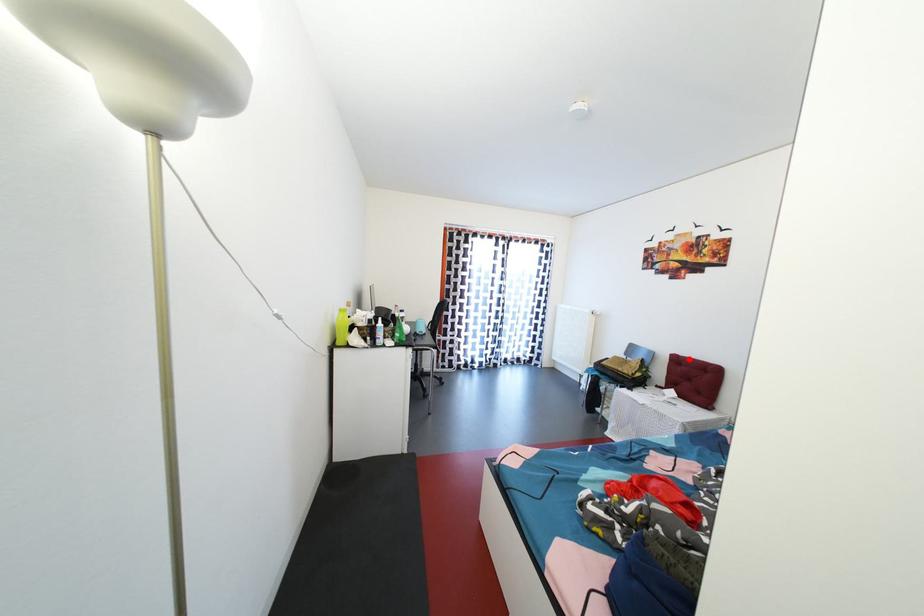
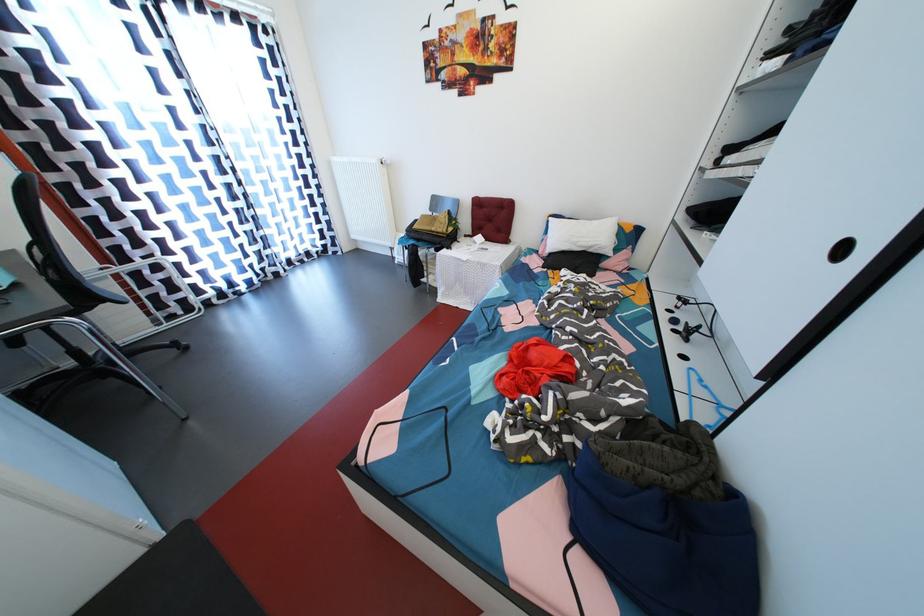
The point at the highlighted location is marked in the first image. Where is the corresponding point in the second image?

(489, 200)